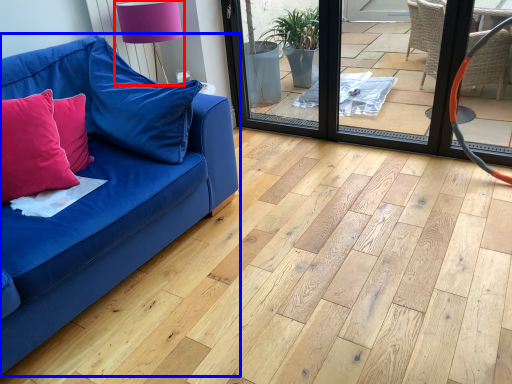
Question: Which object is closer to the camera taking this photo, table lamp (highlighted by a red box) or studio couch (highlighted by a blue box)?

Choices:
 (A) table lamp
 (B) studio couch

Answer: (B)